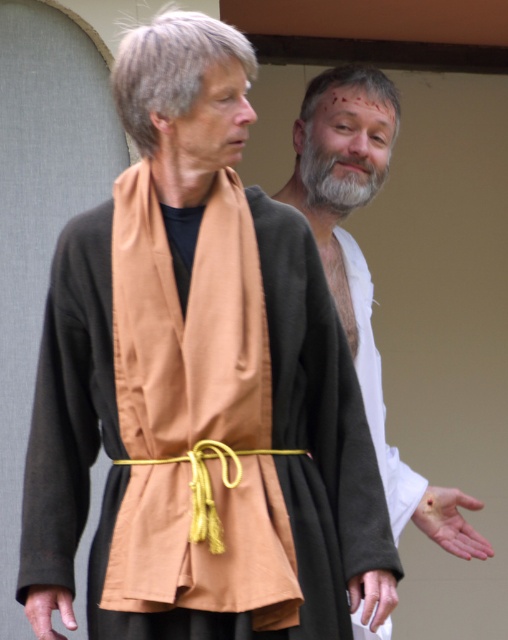
Who is lower down, white matte shirt at upper right or gray matte beard at center?

white matte shirt at upper right is below.

The height and width of the screenshot is (640, 508). Find the location of `white matte shirt at upper right`. white matte shirt at upper right is located at coordinates (365, 269).

The image size is (508, 640). I want to click on white matte shirt at upper right, so click(365, 269).